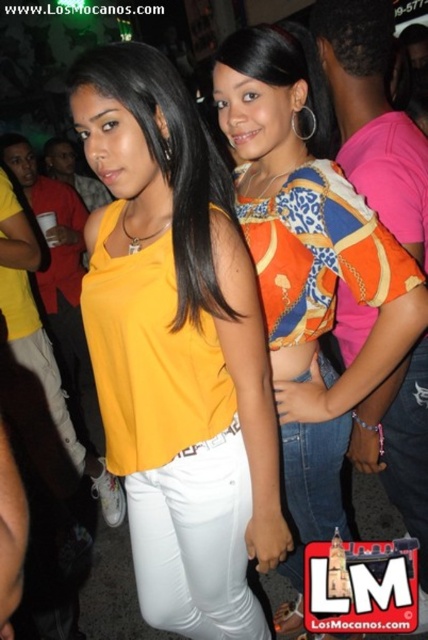
Question: Can you confirm if matte yellow blouse at center is smaller than orange printed blouse at center?

Choices:
 (A) no
 (B) yes

Answer: (B)

Question: In this image, where is matte yellow blouse at center located relative to orange printed blouse at center?

Choices:
 (A) below
 (B) above

Answer: (A)

Question: Among these objects, which one is nearest to the camera?

Choices:
 (A) matte yellow blouse at center
 (B) orange printed blouse at center

Answer: (A)

Question: Which point is closer to the camera?

Choices:
 (A) (131, 211)
 (B) (332, 211)

Answer: (B)

Question: Does matte yellow blouse at center appear on the left side of orange printed blouse at center?

Choices:
 (A) yes
 (B) no

Answer: (A)